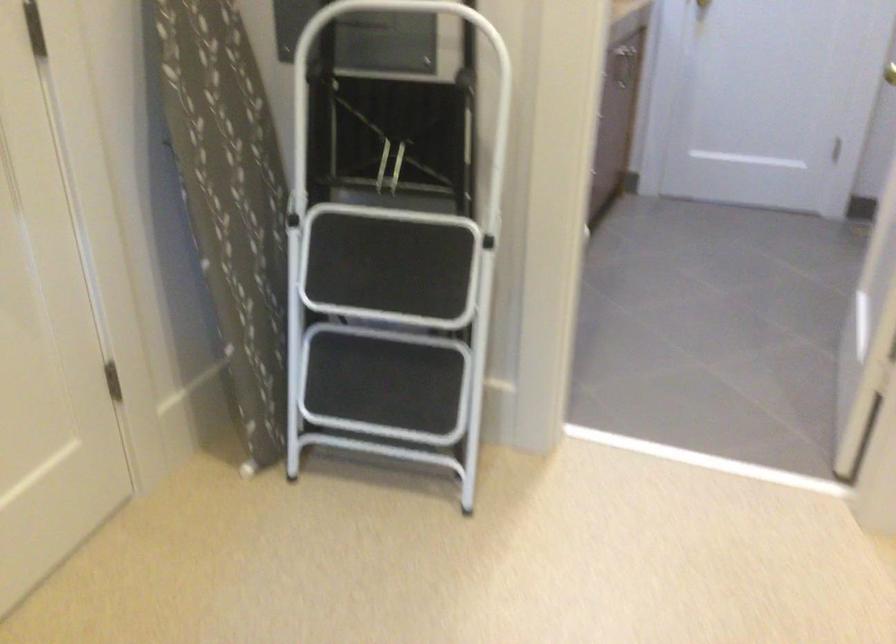
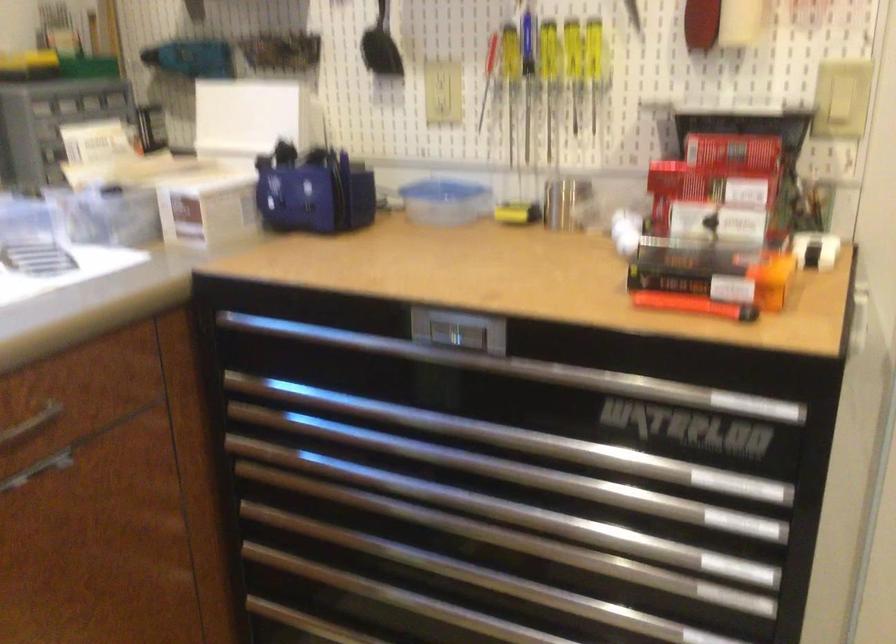
How did the camera likely rotate?

The camera rotated toward left-down.